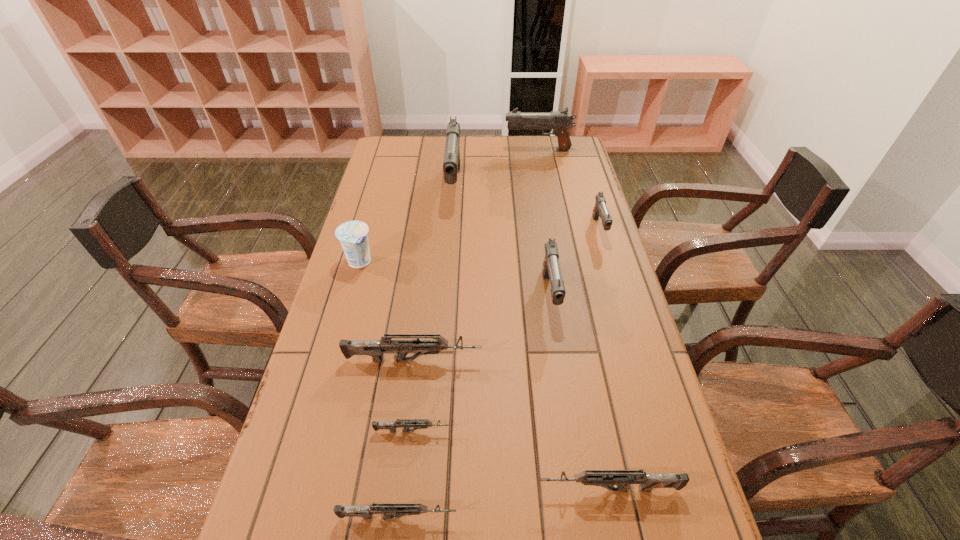
Locate an element on the screen. gun that is the seventh closest to the yogurt is located at coordinates (560, 121).

Identify which gray gun is the second closest to the third shortest gun. Please provide its 2D coordinates. Your answer should be formatted as a tuple, i.e. [(x, y)], where the tuple contains the x and y coordinates of a point satisfying the conditions above.

[(600, 209)]

Find the location of a particular element. the third closest gray gun relative to the eighth nearest object is located at coordinates (600, 209).

Where is `grey gun that stands as the second closest to the farthest grey gun`? The width and height of the screenshot is (960, 540). grey gun that stands as the second closest to the farthest grey gun is located at coordinates (605, 478).

Select which grey gun appears as the second closest to the biggest grey gun. Please provide its 2D coordinates. Your answer should be formatted as a tuple, i.e. [(x, y)], where the tuple contains the x and y coordinates of a point satisfying the conditions above.

[(605, 478)]

I want to click on free spot that satisfies the following two spatial constraints: 1. in the direction the biggest gray gun is aimed; 2. aimed along the barrel of the nearest gun, so click(430, 517).

You are a GUI agent. You are given a task and a screenshot of the screen. Output one action in this format:
    pyautogui.click(x=<x>, y=<y>)
    Task: Click on the free spot that satisfies the following two spatial constraints: 1. in the direction the seventh shortest gun is aimed; 2. on the front side of the yogurt
    The width and height of the screenshot is (960, 540).
    Given the screenshot: What is the action you would take?
    (559, 262)